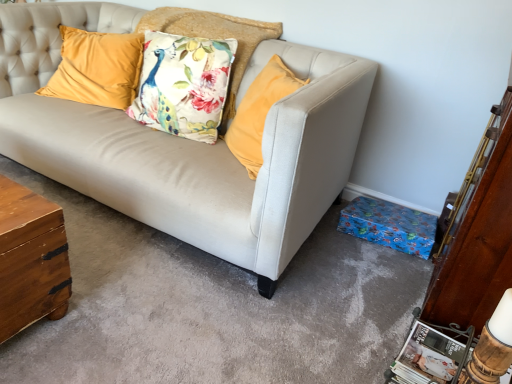
Question: In the image, is velvet yellow pillow at upper left, the first pillow when ordered from left to right, on the left side or the right side of floral fabric cushion at center, placed as the 2th pillow when sorted from left to right?

Choices:
 (A) right
 (B) left

Answer: (B)

Question: Is velvet yellow pillow at upper left, the first pillow when ordered from left to right, situated inside floral fabric cushion at center, placed as the 2th pillow when sorted from left to right, or outside?

Choices:
 (A) outside
 (B) inside

Answer: (A)

Question: From the image's perspective, is velvet yellow pillow at upper left, marked as the 2th pillow in a right-to-left arrangement, above or below floral fabric cushion at center, placed as the 2th pillow when sorted from left to right?

Choices:
 (A) below
 (B) above

Answer: (A)

Question: Considering the positions of point (241, 21) and point (48, 94), is point (241, 21) closer or farther from the camera than point (48, 94)?

Choices:
 (A) farther
 (B) closer

Answer: (B)

Question: From a real-world perspective, is floral fabric cushion at center, which is the 1th pillow in right-to-left order, positioned above or below velvet yellow pillow at upper left, marked as the 2th pillow in a right-to-left arrangement?

Choices:
 (A) above
 (B) below

Answer: (A)

Question: In the image, is floral fabric cushion at center, placed as the 2th pillow when sorted from left to right, on the left side or the right side of velvet yellow pillow at upper left, the first pillow when ordered from left to right?

Choices:
 (A) right
 (B) left

Answer: (A)

Question: From the image's perspective, relative to velvet yellow pillow at upper left, the first pillow when ordered from left to right, is floral fabric cushion at center, which is the 1th pillow in right-to-left order, above or below?

Choices:
 (A) above
 (B) below

Answer: (A)